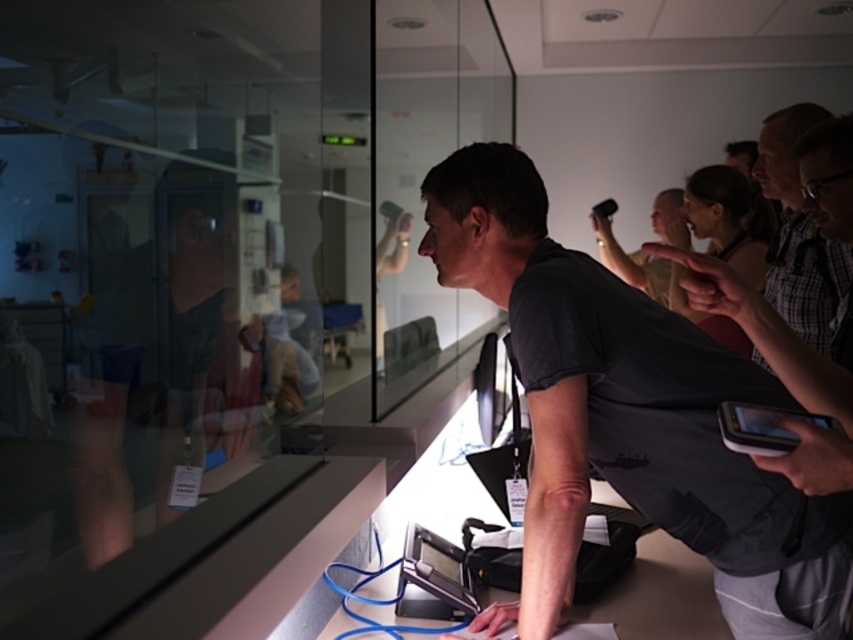
Question: Can you confirm if matte black camera at upper right is bigger than black plastic phone at upper center?

Choices:
 (A) no
 (B) yes

Answer: (B)

Question: Which point appears closest to the camera in this image?

Choices:
 (A) (730, 416)
 (B) (662, 275)
 (C) (444, 192)

Answer: (A)

Question: Is dark gray t-shirt at center to the right of black glossy phone at lower right from the viewer's perspective?

Choices:
 (A) no
 (B) yes

Answer: (A)

Question: Does dark gray t-shirt at center appear on the right side of black glossy phone at lower right?

Choices:
 (A) yes
 (B) no

Answer: (B)

Question: Which is farther from the black plastic phone at upper center?

Choices:
 (A) black glossy phone at lower right
 (B) dark gray t-shirt at center

Answer: (A)

Question: Based on their relative distances, which object is nearer to the black glossy phone at lower right?

Choices:
 (A) matte black camera at upper right
 (B) black plastic phone at upper center

Answer: (A)